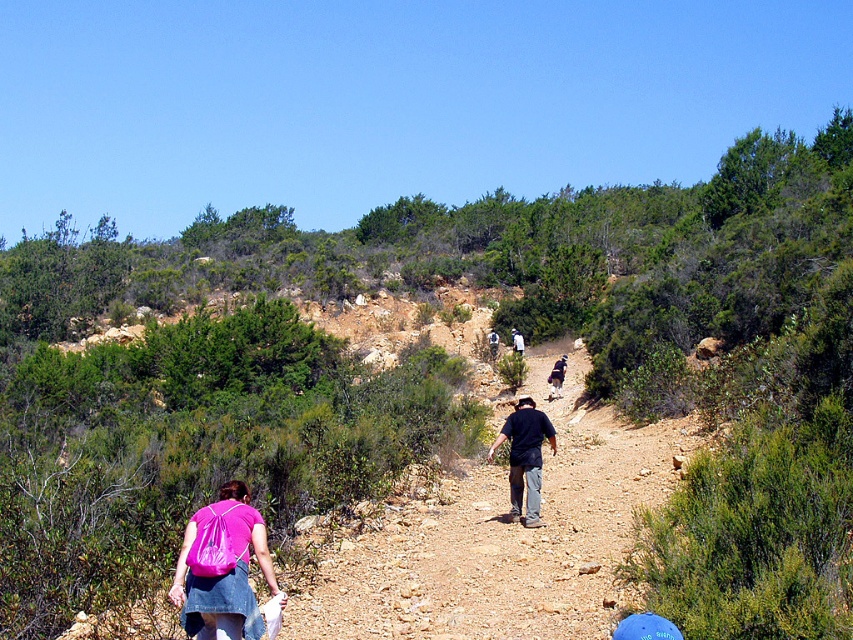
You are a hiker trying to catch up with your friend wearing a dark blue shirt at center. You are currently standing near the pink fabric backpack at lower left. Which direction should you move to get closer to your friend?

You should move forward towards the dark blue shirt at center since the pink fabric backpack at lower left is closer to you than the dark blue shirt at center, meaning your friend is ahead on the trail.

You are a hiker trying to decide whether to carry an extra water bottle. You notice the pink fabric backpack at lower left and the dark blue shirt at center in your view. Which of these items has a larger physical size?

The dark blue shirt at center has a larger physical size compared to the pink fabric backpack at lower left.